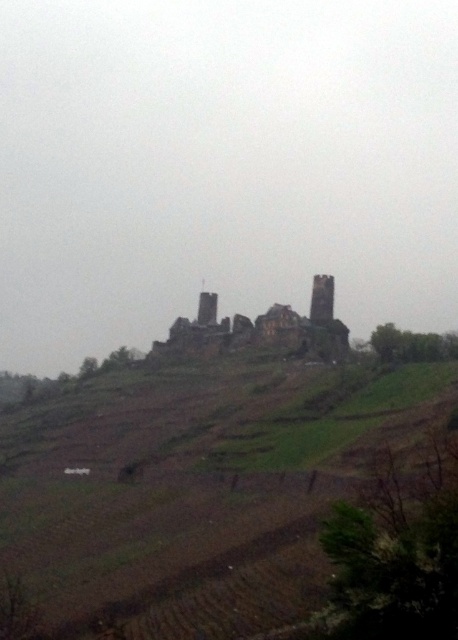
You are a hiker standing at the base of the hill. You see the brown earthy hillside at center and the brown stone tower at center. Which one is taller?

The brown earthy hillside at center is taller than the brown stone tower at center.

You are a hiker planning to climb the hill and reach the rusty stone castle at center. Given that the brown earthy hillside at center is wider than the castle, how might this affect your path?

The brown earthy hillside at center is wider than the rusty stone castle at center, so the path might be more spread out, requiring a broader route to navigate around or across the hillside to reach the castle.